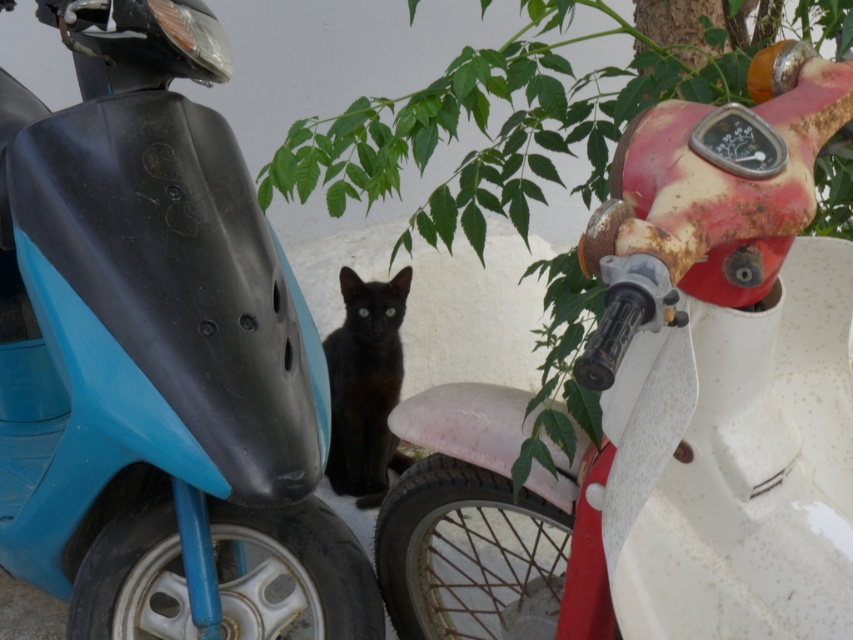
Question: Is rusty white motorcycle at right positioned behind matte black scooter at center?

Choices:
 (A) no
 (B) yes

Answer: (A)

Question: Is rusty white motorcycle at right closer to camera compared to matte black scooter at center?

Choices:
 (A) yes
 (B) no

Answer: (A)

Question: Which object appears closest to the camera in this image?

Choices:
 (A) matte black scooter at center
 (B) black glossy cat at center

Answer: (A)

Question: Among these objects, which one is nearest to the camera?

Choices:
 (A) matte black scooter at center
 (B) black glossy cat at center

Answer: (A)

Question: Where is matte black scooter at center located in relation to black glossy cat at center in the image?

Choices:
 (A) above
 (B) below

Answer: (B)

Question: Which point is closer to the camera?

Choices:
 (A) black glossy cat at center
 (B) rusty white motorcycle at right
 (C) matte black scooter at center

Answer: (B)